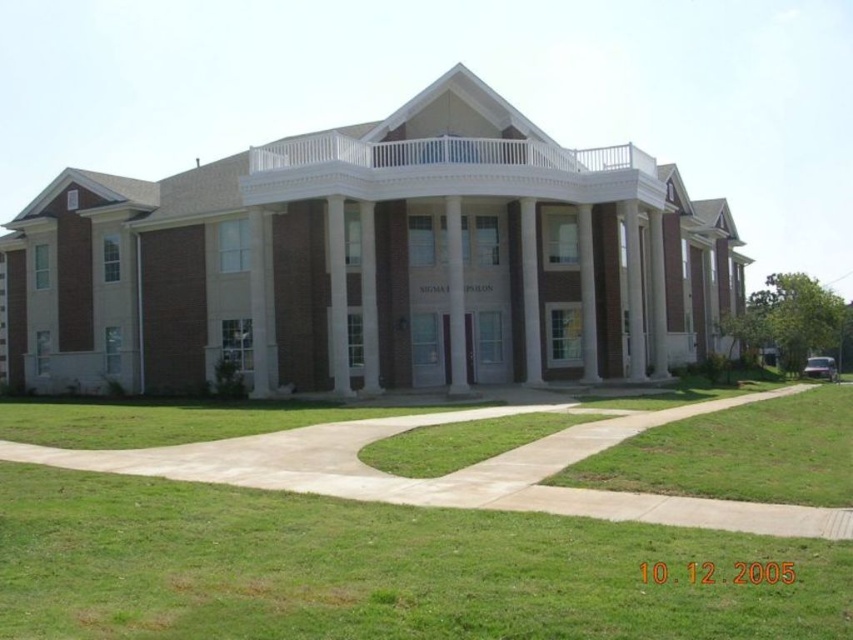
Question: Which point is farther from the camera taking this photo?

Choices:
 (A) (213, 580)
 (B) (393, 145)
 (C) (799, 420)
 (D) (457, 388)

Answer: (B)

Question: Which of these objects is positioned farthest from the white marble pillar at center?

Choices:
 (A) green grass at lower right
 (B) green grass at lower center

Answer: (B)

Question: Is green grass at lower right behind white marble pillar at center?

Choices:
 (A) no
 (B) yes

Answer: (A)

Question: In this image, where is green grass at lower right located relative to white marble pillar at center?

Choices:
 (A) right
 (B) left

Answer: (A)

Question: Among these objects, which one is farthest from the camera?

Choices:
 (A) green grass at lower center
 (B) brown brick building at center

Answer: (B)

Question: Does green grass at lower center come in front of white marble pillar at center?

Choices:
 (A) yes
 (B) no

Answer: (A)